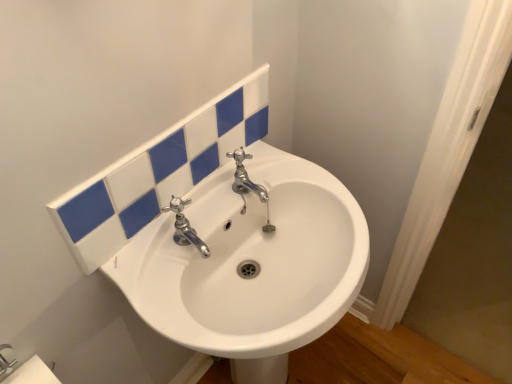
Question: Considering the relative sizes of chrome/metallic faucet at center and white glossy tiles at upper center in the image provided, is chrome/metallic faucet at center taller than white glossy tiles at upper center?

Choices:
 (A) yes
 (B) no

Answer: (B)

Question: Can you confirm if chrome/metallic faucet at center is positioned to the left of white glossy tiles at upper center?

Choices:
 (A) no
 (B) yes

Answer: (A)

Question: Is chrome/metallic faucet at center in contact with white glossy tiles at upper center?

Choices:
 (A) no
 (B) yes

Answer: (A)

Question: Is chrome/metallic faucet at center far from white glossy tiles at upper center?

Choices:
 (A) no
 (B) yes

Answer: (A)

Question: Considering the relative positions of chrome/metallic faucet at center and white glossy tiles at upper center in the image provided, is chrome/metallic faucet at center to the right of white glossy tiles at upper center from the viewer's perspective?

Choices:
 (A) no
 (B) yes

Answer: (B)

Question: Is chrome/metallic faucet at center bigger than white glossy tiles at upper center?

Choices:
 (A) no
 (B) yes

Answer: (A)

Question: Considering the relative positions of white matte toilet paper at lower left and chrome/metallic faucet at center in the image provided, is white matte toilet paper at lower left in front of chrome/metallic faucet at center?

Choices:
 (A) no
 (B) yes

Answer: (B)

Question: Is white matte toilet paper at lower left facing towards chrome/metallic faucet at center?

Choices:
 (A) no
 (B) yes

Answer: (A)

Question: Does white matte toilet paper at lower left appear on the right side of chrome/metallic faucet at center?

Choices:
 (A) yes
 (B) no

Answer: (B)

Question: From a real-world perspective, is white matte toilet paper at lower left on top of chrome/metallic faucet at center?

Choices:
 (A) no
 (B) yes

Answer: (A)

Question: Could chrome/metallic faucet at center be considered to be inside white matte toilet paper at lower left?

Choices:
 (A) no
 (B) yes

Answer: (A)

Question: From the image's perspective, does white matte toilet paper at lower left appear higher than chrome/metallic faucet at center?

Choices:
 (A) yes
 (B) no

Answer: (B)

Question: Can you confirm if chrome/metallic faucet at center is thinner than white matte toilet paper at lower left?

Choices:
 (A) yes
 (B) no

Answer: (B)